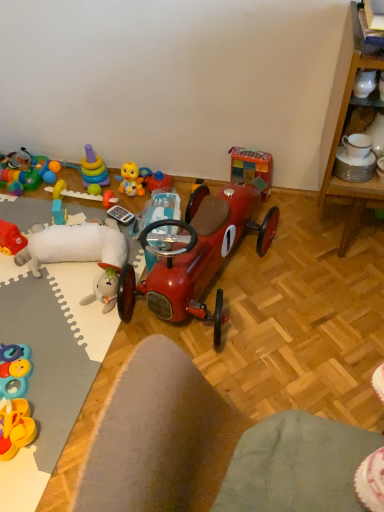
The image size is (384, 512). I want to click on vacant area that lies in front of rubberized plastic toy at center, placed as the 6th toy when sorted from left to right, so click(86, 215).